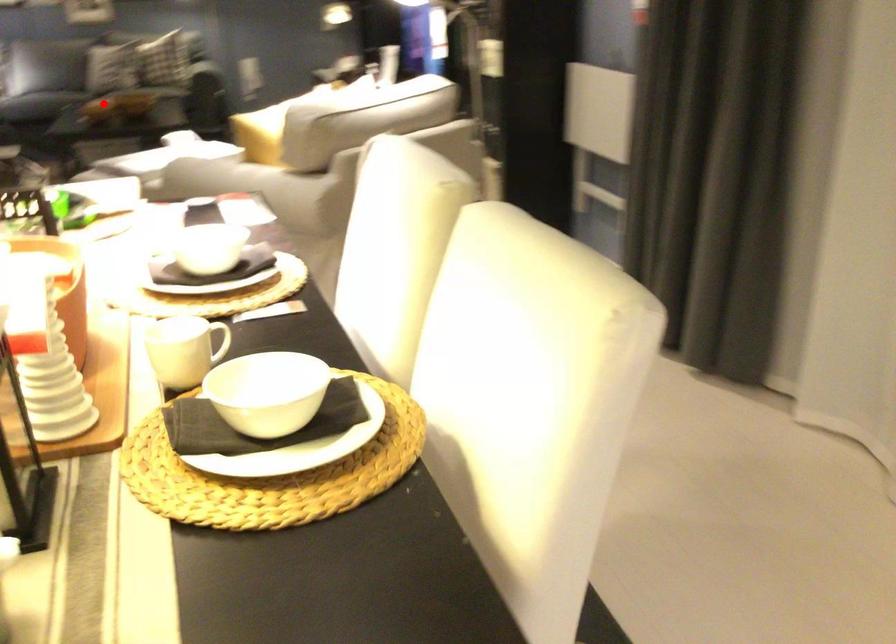
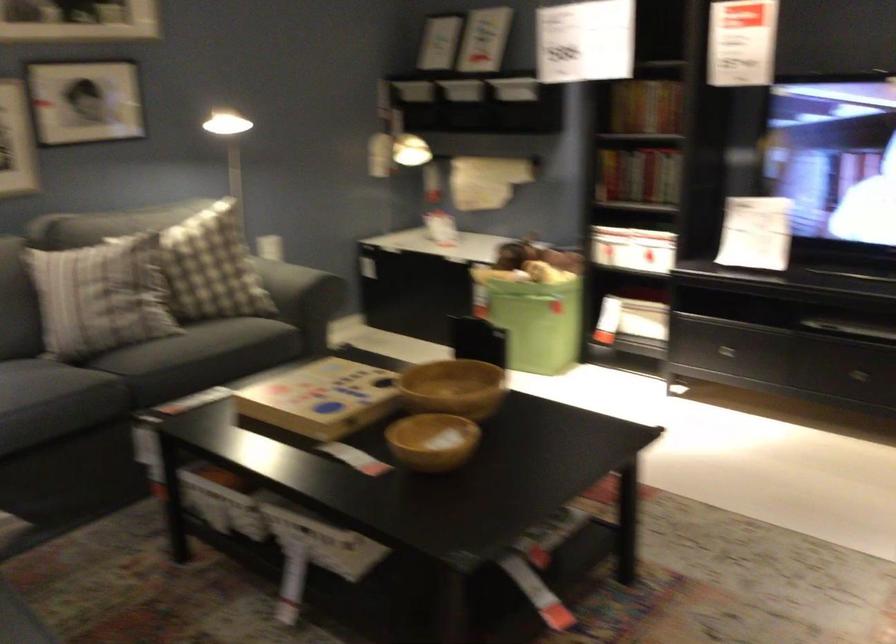
Question: I am providing you with two images of the same scene from different viewpoints. In image1, a red point is highlighted. Considering the same 3D point in image2, which of the following is correct?

Choices:
 (A) It is closer
 (B) It is farther

Answer: (A)